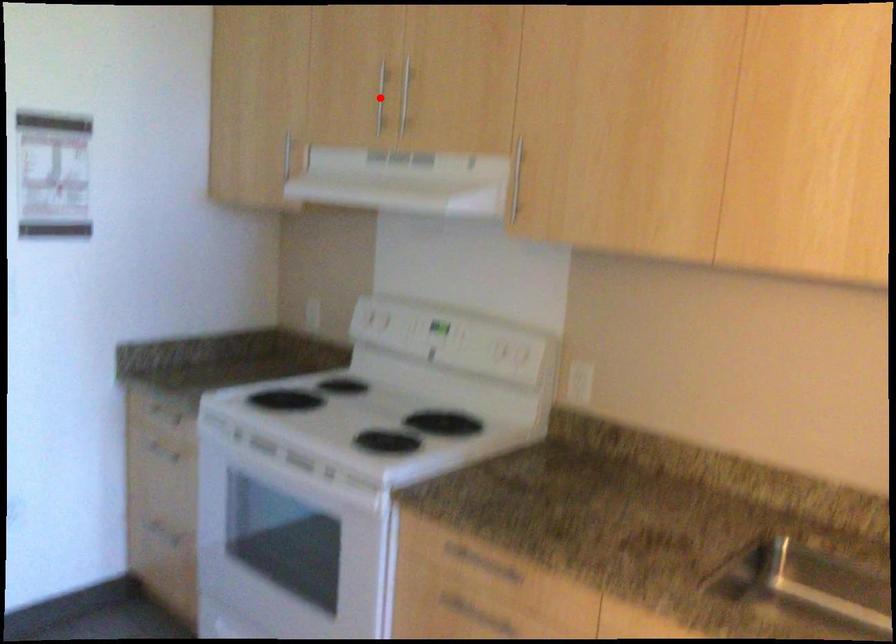
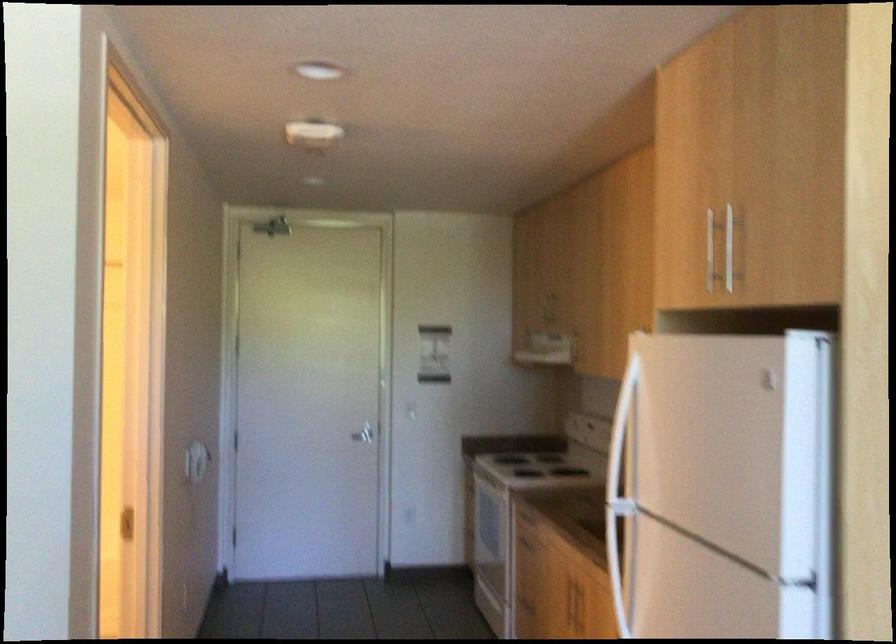
Question: I am providing you with two images of the same scene from different viewpoints. A red point is marked on the first image. At the location where the point appears in image 1, is it still visible in image 2?

Choices:
 (A) Yes
 (B) No

Answer: (B)